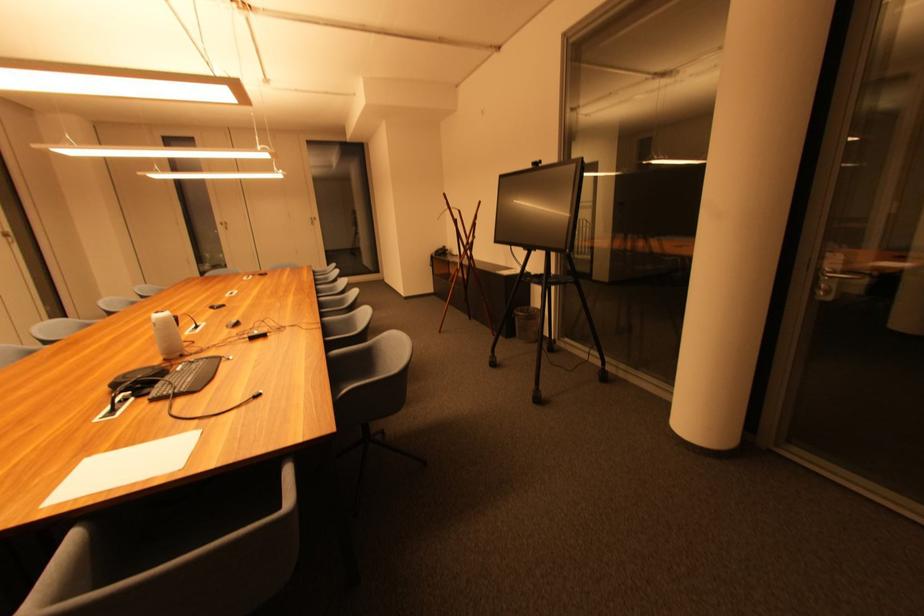
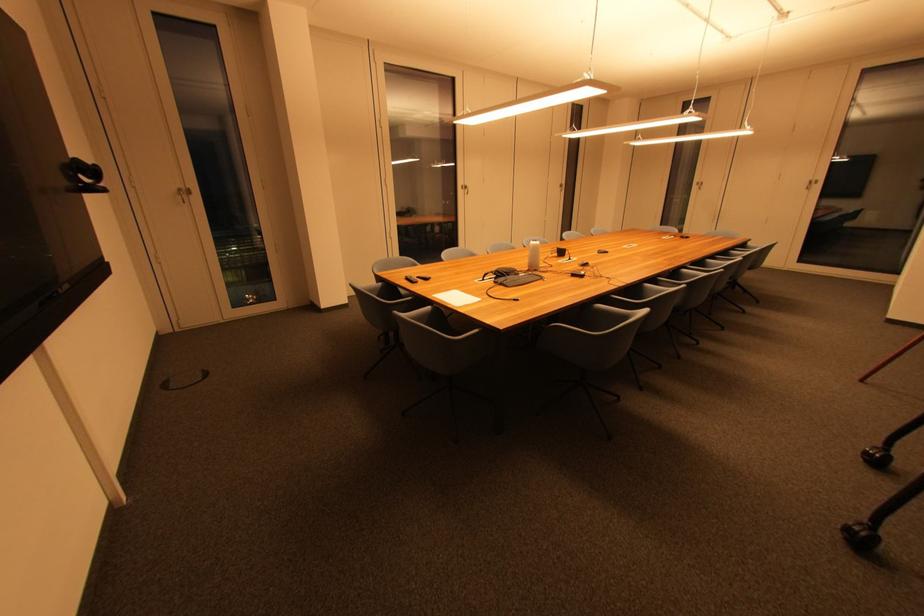
Find the pixel in the second image that matches (x=159, y=402) in the first image.

(500, 285)